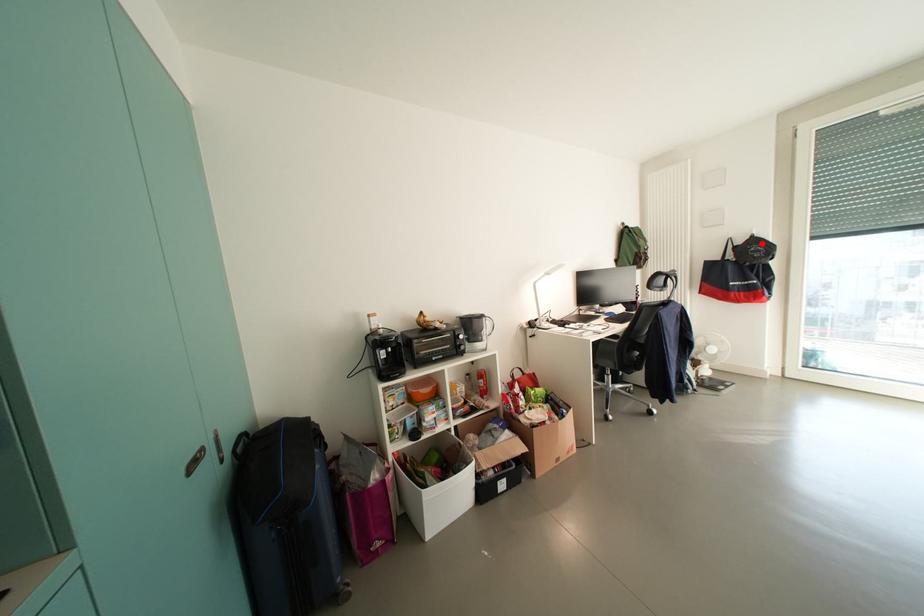
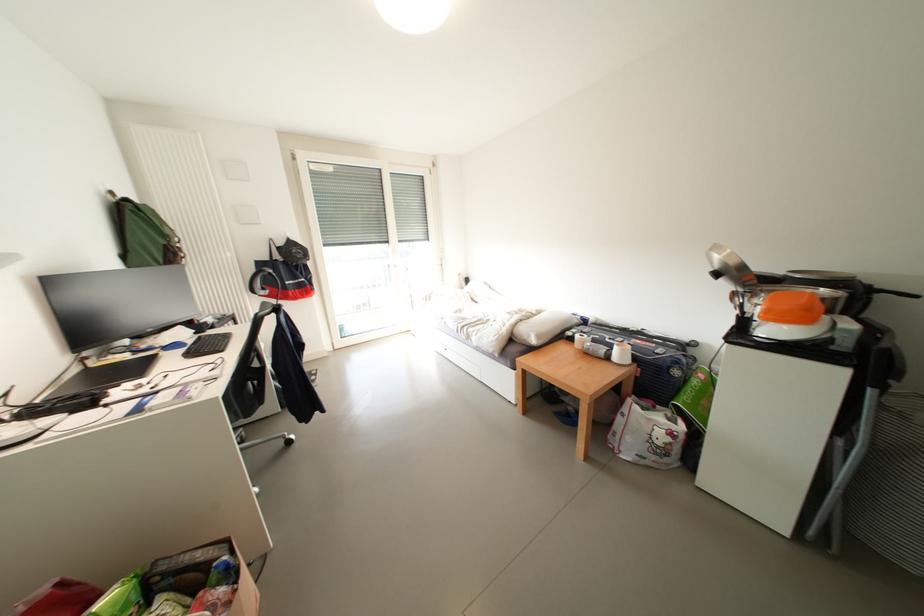
Locate, in the second image, the point that corresponds to the highlighted location in the first image.

(298, 246)